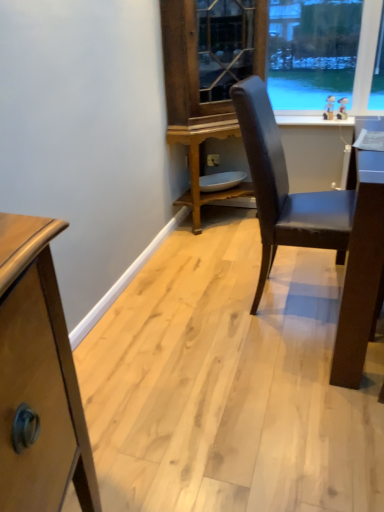
Question: Considering the relative positions of white plastic power outlet at center and wooden cabinet at center in the image provided, is white plastic power outlet at center behind wooden cabinet at center?

Choices:
 (A) no
 (B) yes

Answer: (B)

Question: From a real-world perspective, is white plastic power outlet at center on top of wooden cabinet at center?

Choices:
 (A) no
 (B) yes

Answer: (A)

Question: Considering the relative sizes of white plastic power outlet at center and wooden cabinet at center in the image provided, is white plastic power outlet at center smaller than wooden cabinet at center?

Choices:
 (A) yes
 (B) no

Answer: (A)

Question: Can you confirm if white plastic power outlet at center is taller than wooden cabinet at center?

Choices:
 (A) no
 (B) yes

Answer: (A)

Question: Are white plastic power outlet at center and wooden cabinet at center making contact?

Choices:
 (A) yes
 (B) no

Answer: (B)

Question: Is white plastic power outlet at center looking in the opposite direction of wooden cabinet at center?

Choices:
 (A) no
 (B) yes

Answer: (A)

Question: Is wooden cabinet at center surrounded by matte black chair at center?

Choices:
 (A) no
 (B) yes

Answer: (A)

Question: Would you say matte black chair at center is a long distance from wooden cabinet at center?

Choices:
 (A) yes
 (B) no

Answer: (A)

Question: Is matte black chair at center bigger than wooden cabinet at center?

Choices:
 (A) no
 (B) yes

Answer: (A)

Question: Does matte black chair at center have a lesser height compared to wooden cabinet at center?

Choices:
 (A) no
 (B) yes

Answer: (B)

Question: Considering the relative sizes of matte black chair at center and wooden cabinet at center in the image provided, is matte black chair at center thinner than wooden cabinet at center?

Choices:
 (A) yes
 (B) no

Answer: (B)

Question: Does matte black chair at center appear on the left side of wooden cabinet at center?

Choices:
 (A) yes
 (B) no

Answer: (B)

Question: Can you confirm if wooden cabinet at center is positioned to the right of white plastic power outlet at center?

Choices:
 (A) yes
 (B) no

Answer: (A)